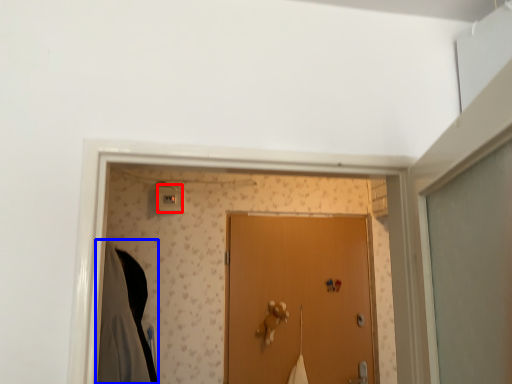
Question: Which object is closer to the camera taking this photo, light switch (highlighted by a red box) or robe (highlighted by a blue box)?

Choices:
 (A) light switch
 (B) robe

Answer: (B)